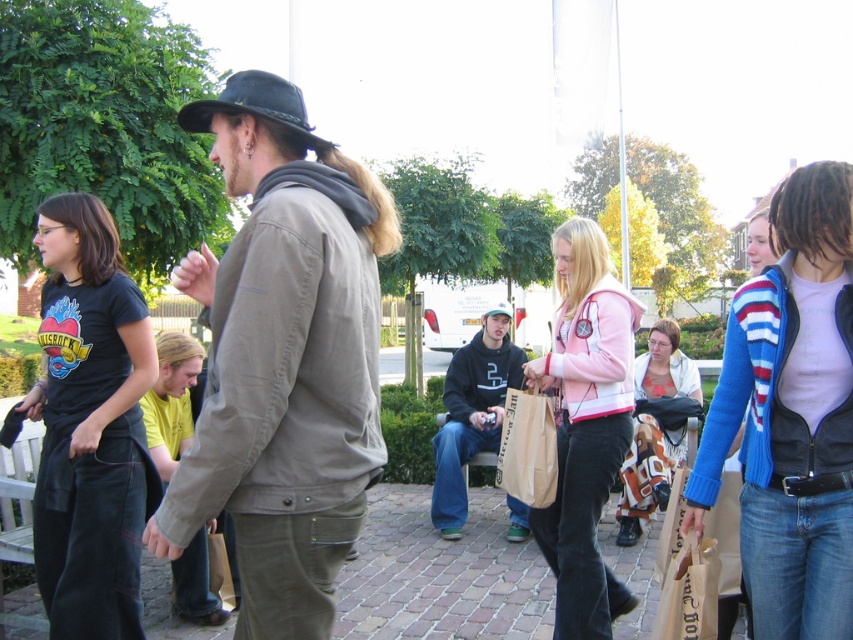
You are standing at the center of the image and want to find the dark blue jeans at center. According to the spatial coordinates provided, in which direction should you look to locate them?

The dark blue jeans at center is located at point coordinates, so you should look towards the center of the image to find them.

You are planning to place a small potted plant on the brown brick pavement at center and the black felt hat at center. Based on their sizes, which object can accommodate the plant without overcrowding?

The black felt hat at center can accommodate the plant without overcrowding because it occupies more space than the brown brick pavement at center.